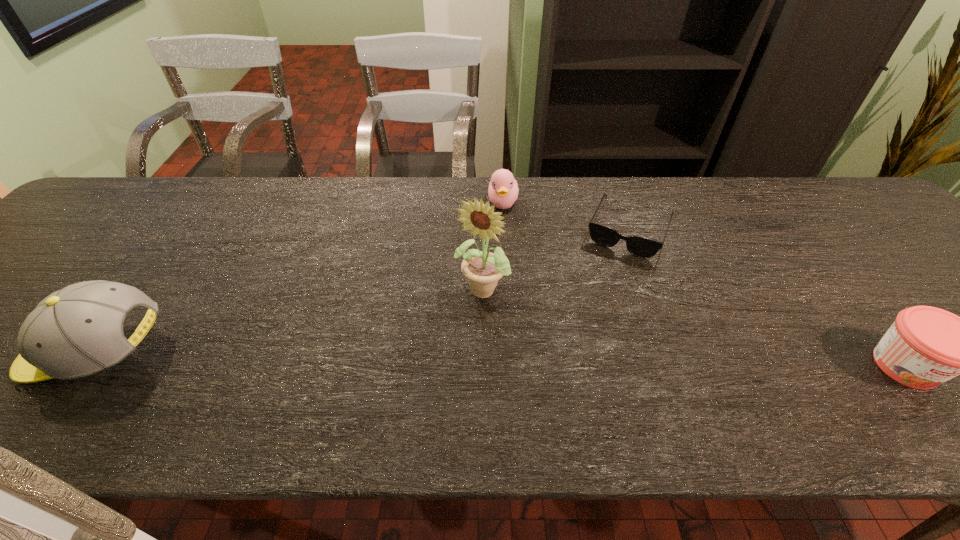
Find the location of a particular element. duckling is located at coordinates (503, 190).

Locate an element on the screen. The height and width of the screenshot is (540, 960). sunglasses is located at coordinates (639, 246).

Find the location of `the shortest object`. the shortest object is located at coordinates (639, 246).

The height and width of the screenshot is (540, 960). What are the coordinates of `the third nearest object` in the screenshot? It's located at (483, 269).

Locate an element on the screen. The image size is (960, 540). the tallest object is located at coordinates (483, 269).

At what (x,y) coordinates should I click in order to perform the action: click on vacant space positioned 0.360m on the front-facing side of the duckling. Please return your answer as a coordinate pair (x, y). The image size is (960, 540). Looking at the image, I should click on (514, 320).

The image size is (960, 540). I want to click on free space located 0.310m on the front-facing side of the duckling, so click(x=512, y=303).

In order to click on free space located on the front-facing side of the duckling in this screenshot , I will do `click(507, 252)`.

Locate an element on the screen. This screenshot has width=960, height=540. free space located 0.140m at the front lenses of the second object from right to left is located at coordinates (602, 295).

This screenshot has height=540, width=960. I want to click on free region located 0.350m at the front lenses of the second object from right to left, so click(573, 365).